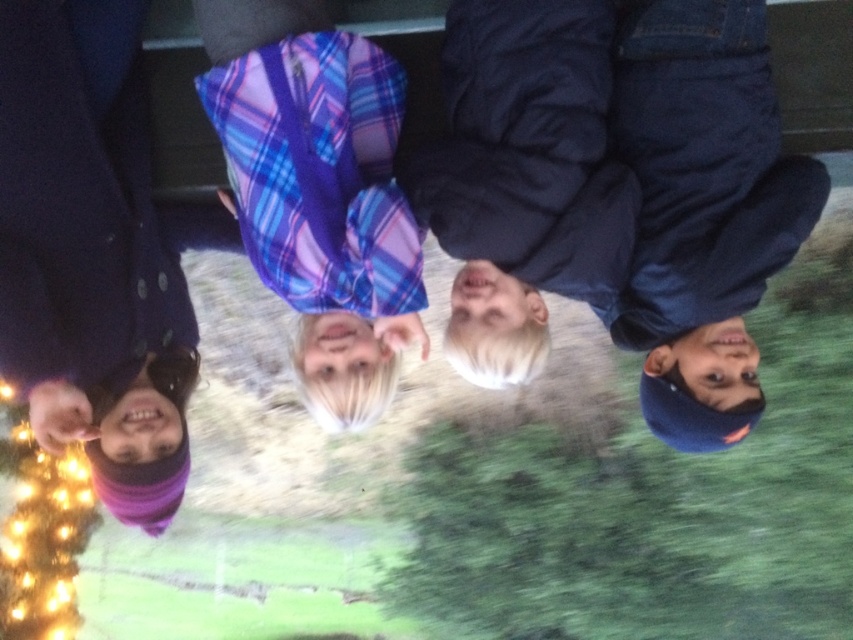
Question: Estimate the real-world distances between objects in this image. Which object is farther from the purple woolen hat at lower left?

Choices:
 (A) dark blue puffy jacket at center
 (B) plaid fabric shirt at center

Answer: (A)

Question: Is dark blue puffy jacket at center closer to the viewer compared to plaid fabric shirt at center?

Choices:
 (A) yes
 (B) no

Answer: (B)

Question: Which object appears closest to the camera in this image?

Choices:
 (A) purple woolen hat at lower left
 (B) dark blue puffy jacket at center
 (C) plaid fabric shirt at center

Answer: (A)

Question: Estimate the real-world distances between objects in this image. Which object is farther from the dark blue puffy jacket at center?

Choices:
 (A) plaid fabric shirt at center
 (B) purple woolen hat at lower left

Answer: (B)

Question: Is dark blue puffy jacket at center bigger than plaid fabric shirt at center?

Choices:
 (A) yes
 (B) no

Answer: (A)

Question: Can you confirm if purple woolen hat at lower left is positioned to the right of plaid fabric shirt at center?

Choices:
 (A) no
 (B) yes

Answer: (A)